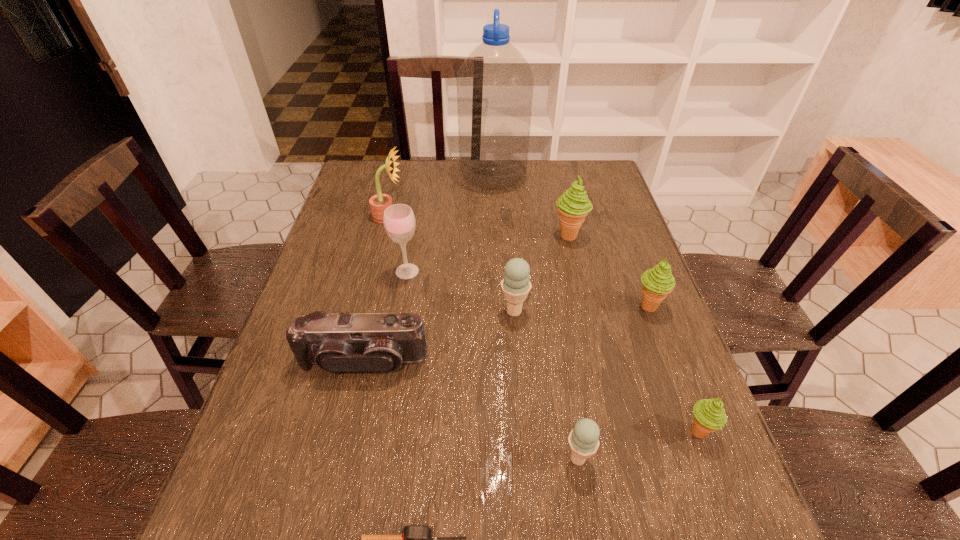
Find the location of a particular element. black camcorder is located at coordinates (371, 342).

Find the location of a particular element. This screenshot has height=540, width=960. the right blue ice cream is located at coordinates (583, 439).

The image size is (960, 540). What are the coordinates of `the fourth icecream from right to left` in the screenshot? It's located at (583, 439).

Where is `the smallest green icecream`? The height and width of the screenshot is (540, 960). the smallest green icecream is located at coordinates (709, 414).

Find the location of `vacant space located 0.090m on the left of the tallest object`. vacant space located 0.090m on the left of the tallest object is located at coordinates [x=434, y=177].

Identify the location of vacant space situated 0.200m on the face of the yellow sunflower. The height and width of the screenshot is (540, 960). (468, 217).

This screenshot has width=960, height=540. Identify the location of free location located on the left of the leftmost green icecream. (512, 236).

The image size is (960, 540). Identify the location of vacant area located on the right of the seventh nearest object. (462, 271).

Find the location of a particular element. The height and width of the screenshot is (540, 960). free space located on the right of the leftmost icecream is located at coordinates (548, 311).

The width and height of the screenshot is (960, 540). Find the location of `free spot located 0.120m on the front of the second farthest green icecream`. free spot located 0.120m on the front of the second farthest green icecream is located at coordinates (668, 359).